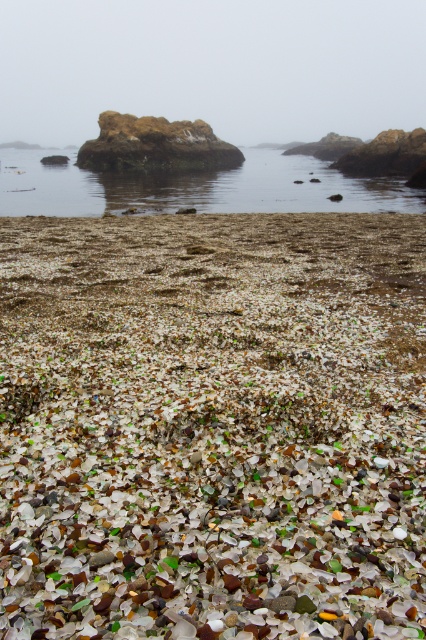
You are standing at the edge of the beach and want to walk to both the point at coordinates point (302, 529) and point (103, 172). Which point will you reach first if you start walking towards them?

You will reach point (302, 529) first because it is closer to you than point (103, 172).

You are standing at the edge of the beach looking out towards the calm waters. There are two points marked on the image, point A at coordinates point (x=371, y=211) and point B at coordinates point (x=137, y=129). Which point is closer to you?

Point A at coordinates point (x=371, y=211) is closer to you because it is closer to the camera than point B at coordinates point (x=137, y=129).

You are standing on the beach and see the point marked at coordinates (193, 186). What is the material at that location?

The point at coordinates (193, 186) corresponds to clear water at center.